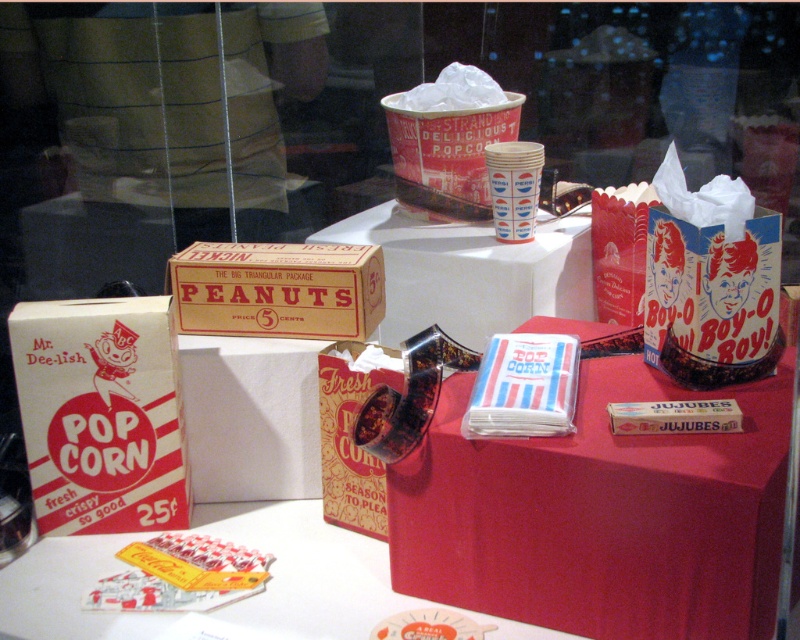
Question: Among these objects, which one is nearest to the camera?

Choices:
 (A) white paper napkins at center
 (B) white paper napkin at center

Answer: (A)

Question: Does white paper popcorn at lower left have a lesser width compared to white paper cup at center?

Choices:
 (A) yes
 (B) no

Answer: (B)

Question: Does white paper table at lower center appear on the left side of matte cardboard peanuts box at center?

Choices:
 (A) no
 (B) yes

Answer: (B)

Question: Which of the following is the farthest from the observer?

Choices:
 (A) (413, 600)
 (B) (100, 497)

Answer: (B)

Question: Is matte paper candy at lower left further to camera compared to white paper cup at center?

Choices:
 (A) yes
 (B) no

Answer: (B)

Question: Which object is the farthest from the matte cardboard peanuts box at center?

Choices:
 (A) white paper napkins at center
 (B) white paper popcorn at lower left
 (C) matte paper candy at lower left

Answer: (C)